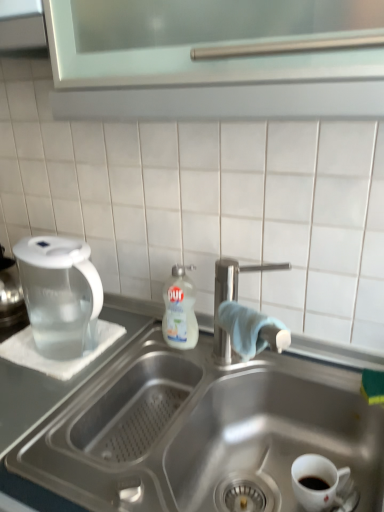
Identify the location of vacant space that is to the left of white glossy dish soap at center. (134, 354).